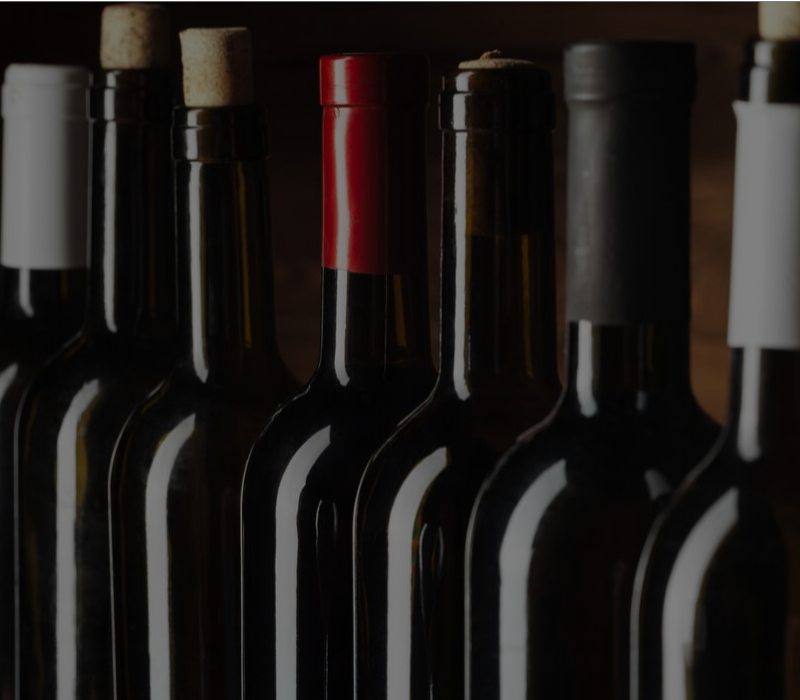
Where is `bottles`? The image size is (800, 700). bottles is located at coordinates (734, 638), (536, 648), (405, 666), (305, 640), (192, 617), (57, 612), (9, 598).